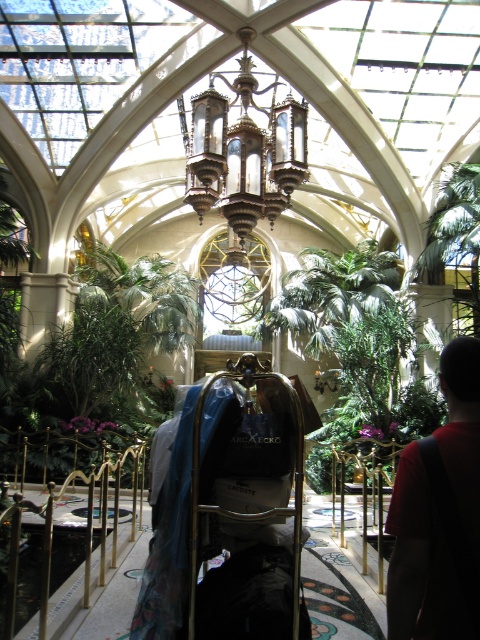
You are a hotel employee who needs to hang a new coat rack that is 1.2 meters tall. You see the dark red shirt at lower right and the polished brass chandelier at center. Which object can the coat rack be placed next to without blocking the view of the other object?

The dark red shirt at lower right is taller than the polished brass chandelier at center. Since the coat rack is 1.2 meters tall, it should be placed next to the polished brass chandelier at center to avoid blocking the view of the taller dark red shirt at lower right.

You are a hotel staff member who needs to move the metallic gold luggage cart at center to the front desk located at point 0.789, 0.471. Is the cart already at the correct location?

The metallic gold luggage cart at center is already located at point (226, 504), so it is already at the correct location.

You are a hotel staff member who needs to fold the dark red shirt at lower right and the polished brass chandelier at center. Which item requires a larger folding space?

The dark red shirt at lower right requires a larger folding space because its width is greater than the polished brass chandelier at center.